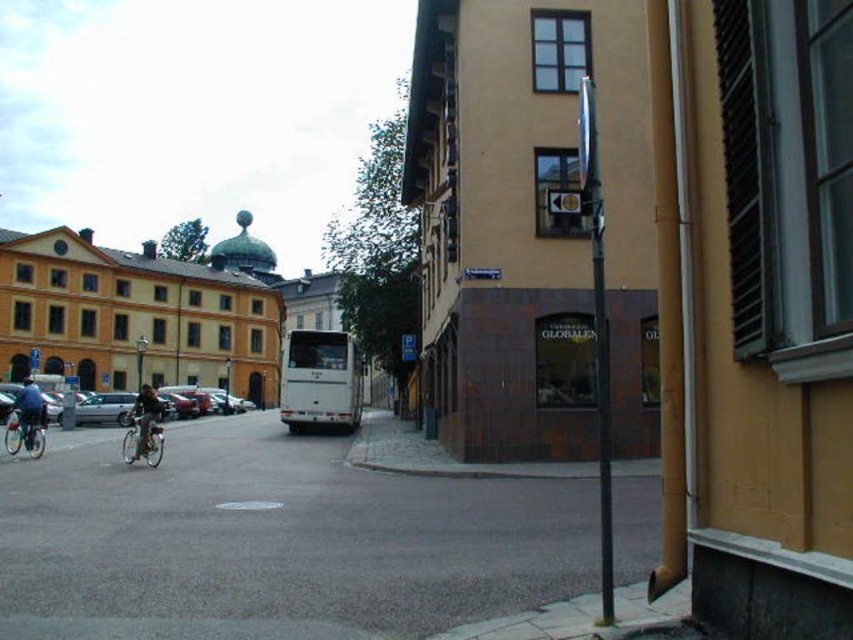
Does silver metallic bicycle at left have a lesser height compared to silver metallic bicycle at lower left?

No, silver metallic bicycle at left is not shorter than silver metallic bicycle at lower left.

Is silver metallic bicycle at left above silver metallic bicycle at lower left?

Incorrect, silver metallic bicycle at left is not positioned above silver metallic bicycle at lower left.

The width and height of the screenshot is (853, 640). Describe the element at coordinates (143, 440) in the screenshot. I see `silver metallic bicycle at left` at that location.

Image resolution: width=853 pixels, height=640 pixels. In order to click on silver metallic bicycle at left in this screenshot , I will do `click(143, 440)`.

The image size is (853, 640). Describe the element at coordinates (143, 440) in the screenshot. I see `silver metallic bicycle at left` at that location.

Between silver metallic bicycle at left and blue fabric jacket on the left, which one has less height?

With less height is silver metallic bicycle at left.

Where is `silver metallic bicycle at left`? The image size is (853, 640). silver metallic bicycle at left is located at coordinates (143, 440).

Measure the distance between dark brown leather jacket at left and blue fabric jacket on the left.

They are 25.32 feet apart.

Who is higher up, dark brown leather jacket at left or blue fabric jacket on the left?

blue fabric jacket on the left is above.

Is point (138, 404) less distant than point (44, 404)?

Yes, it is.

Find the location of a particular element. This screenshot has width=853, height=640. dark brown leather jacket at left is located at coordinates (146, 424).